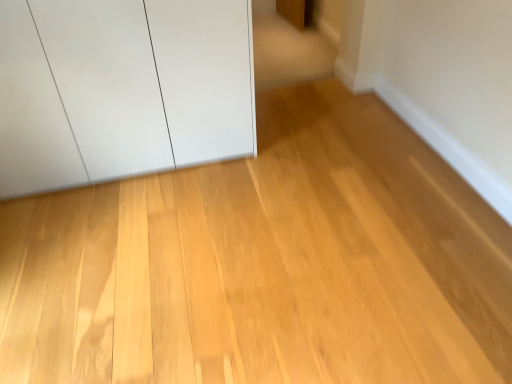
Locate an element on the screen. Image resolution: width=512 pixels, height=384 pixels. vacant region in front of white matte cupboard at upper left is located at coordinates (124, 248).